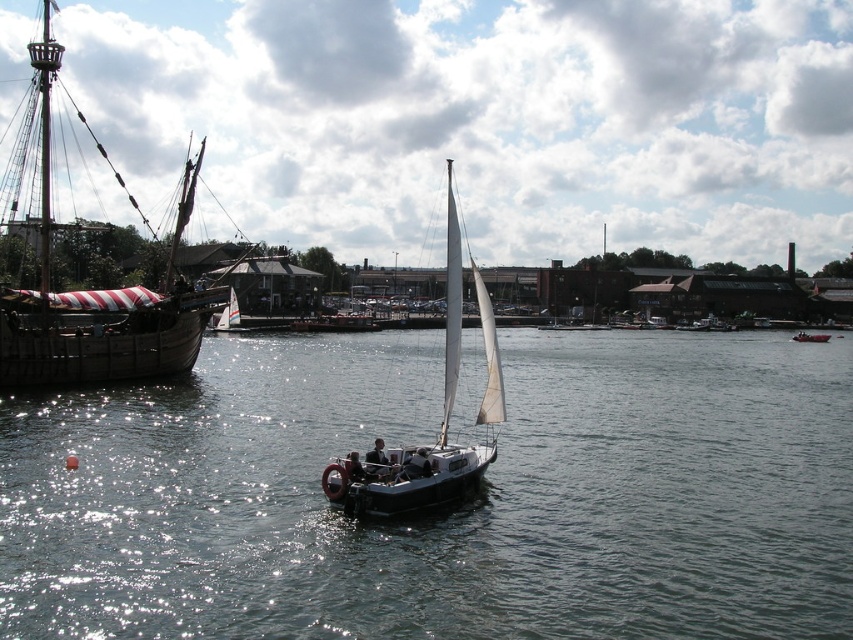
Who is shorter, clear water at center or white sailboat at center?

clear water at center is shorter.

Does clear water at center appear on the right side of white sailboat at center?

No, clear water at center is not to the right of white sailboat at center.

Is point (561, 374) farther from viewer compared to point (352, 476)?

Yes, point (561, 374) is behind point (352, 476).

Locate an element on the screen. clear water at center is located at coordinates (447, 515).

Consider the image. Who is more forward, [520,432] or [811,337]?

Point [520,432] is in front.

The width and height of the screenshot is (853, 640). Describe the element at coordinates (447, 515) in the screenshot. I see `clear water at center` at that location.

At what (x,y) coordinates should I click in order to perform the action: click on clear water at center. Please return your answer as a coordinate pair (x, y). This screenshot has height=640, width=853. Looking at the image, I should click on (447, 515).

Can you confirm if wooden ship at left is thinner than white sailboat at center?

Incorrect, wooden ship at left's width is not less than white sailboat at center's.

Is wooden ship at left wider than white sailboat at center?

Yes.

Is point (173, 310) in front of point (408, 490)?

No.

Where is `wooden ship at left`? wooden ship at left is located at coordinates (97, 292).